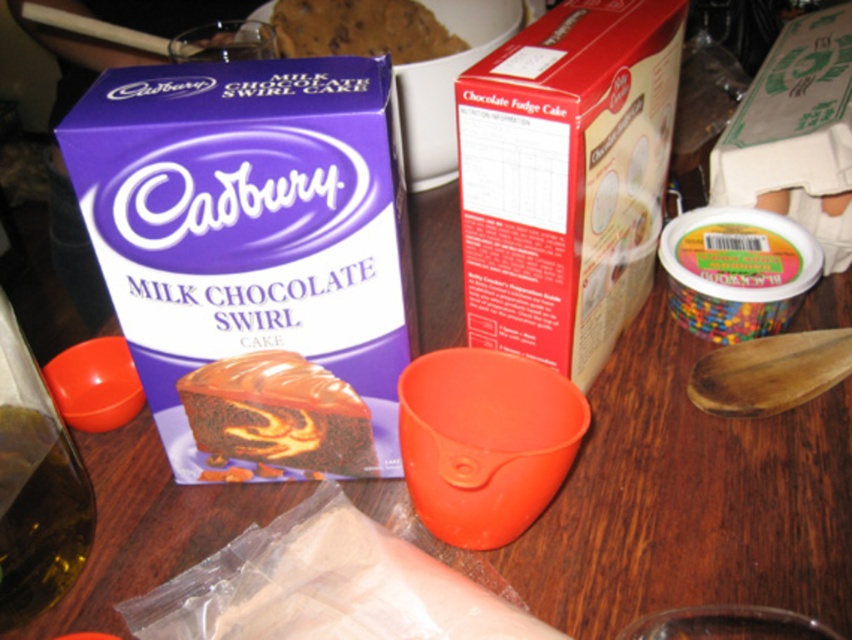
Question: Is purple cardboard box at upper left smaller than swirled chocolate cake at center?

Choices:
 (A) yes
 (B) no

Answer: (B)

Question: Does swirled chocolate cake at center have a lesser width compared to chocolate chip cookie at upper center?

Choices:
 (A) no
 (B) yes

Answer: (B)

Question: Which is farther from the translucent amber liquid at lower left?

Choices:
 (A) swirled chocolate cake at center
 (B) purple cardboard box at upper left
 (C) chocolate chip cookie at upper center

Answer: (C)

Question: Which point appears farthest from the camera in this image?

Choices:
 (A) (158, 429)
 (B) (593, 244)

Answer: (A)

Question: Does purple cardboard box at upper left appear under translucent amber liquid at lower left?

Choices:
 (A) yes
 (B) no

Answer: (B)

Question: Which of the following is the closest to the observer?

Choices:
 (A) (9, 436)
 (B) (275, 433)
 (C) (269, 310)

Answer: (C)